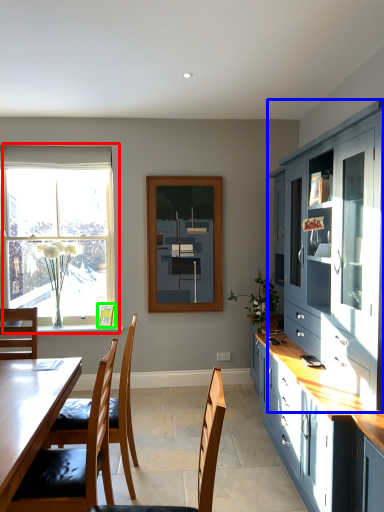
Question: Estimate the real-world distances between objects in this image. Which object is farther from window (highlighted by a red box), cabinetry (highlighted by a blue box) or picture frame (highlighted by a green box)?

Choices:
 (A) cabinetry
 (B) picture frame

Answer: (A)